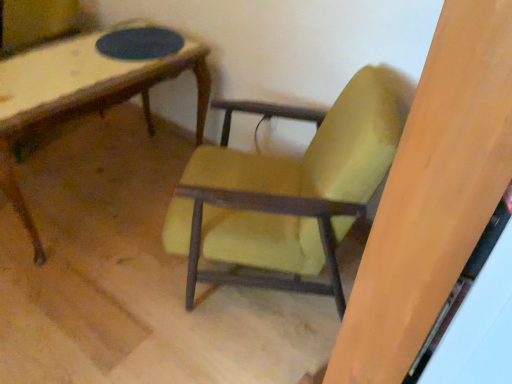
Find the location of a particular element. This screenshot has height=384, width=512. yellow fabric chair at center is located at coordinates (286, 194).

Measure the distance between point (290, 179) and camera.

Point (290, 179) and camera are 1.60 meters apart.

What do you see at coordinates (286, 194) in the screenshot? I see `yellow fabric chair at center` at bounding box center [286, 194].

Where is `yellow fabric chair at center`? yellow fabric chair at center is located at coordinates (286, 194).